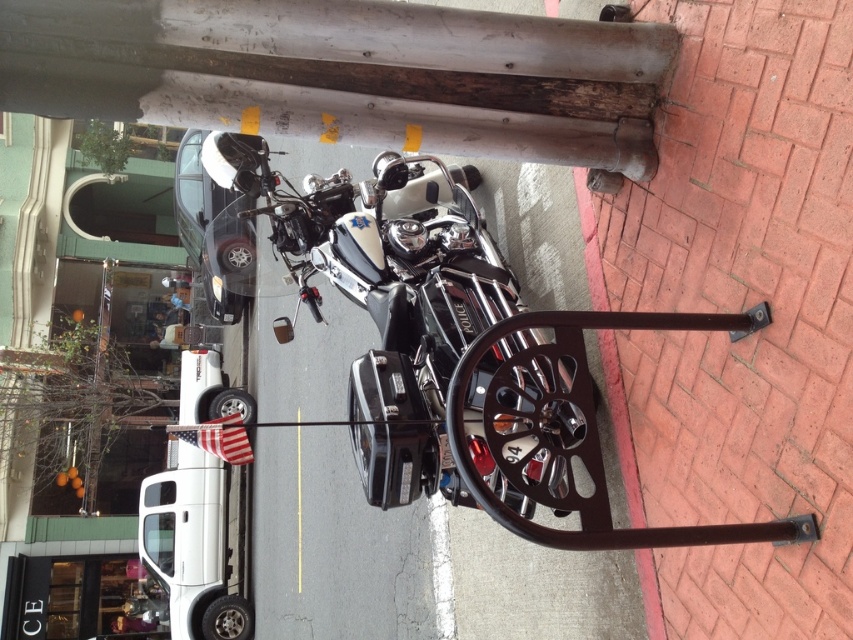
Question: Which point is farther to the camera?

Choices:
 (A) (254, 188)
 (B) (610, 340)

Answer: (A)

Question: Does shiny chrome motorcycle at center appear over brick at lower right?

Choices:
 (A) yes
 (B) no

Answer: (A)

Question: Is shiny chrome motorcycle at center wider than brick at lower right?

Choices:
 (A) no
 (B) yes

Answer: (B)

Question: Which object appears closest to the camera in this image?

Choices:
 (A) shiny chrome motorcycle at center
 (B) brick at lower right

Answer: (A)

Question: Is shiny chrome motorcycle at center positioned behind brick at lower right?

Choices:
 (A) no
 (B) yes

Answer: (A)

Question: Which point is farther to the camera?

Choices:
 (A) (608, 408)
 (B) (462, 248)

Answer: (B)